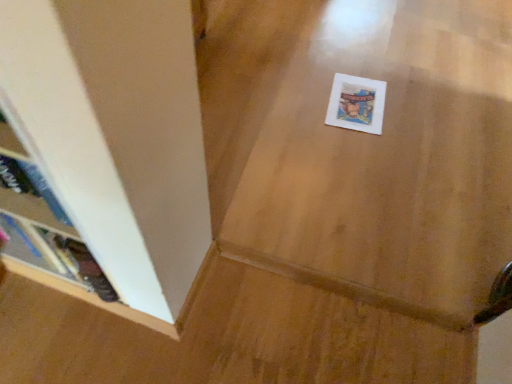
The image size is (512, 384). What do you see at coordinates (42, 220) in the screenshot?
I see `wooden bookshelf at left` at bounding box center [42, 220].

Identify the location of wooden bookshelf at left. The width and height of the screenshot is (512, 384). (42, 220).

Where is `white paper postcard at center`? The width and height of the screenshot is (512, 384). white paper postcard at center is located at coordinates (356, 104).

Measure the distance between white paper postcard at center and camera.

white paper postcard at center and camera are 5.18 feet apart from each other.

The width and height of the screenshot is (512, 384). What do you see at coordinates (356, 104) in the screenshot?
I see `white paper postcard at center` at bounding box center [356, 104].

Identify the location of wooden bookshelf at left. This screenshot has width=512, height=384. (42, 220).

Between wooden bookshelf at left and white paper postcard at center, which one appears on the right side from the viewer's perspective?

Positioned to the right is white paper postcard at center.

Is wooden bookshelf at left closer to camera compared to white paper postcard at center?

Yes, wooden bookshelf at left is in front of white paper postcard at center.

Is point (108, 282) positioned after point (382, 123)?

No, (108, 282) is closer to viewer.

Consider the image. From the image's perspective, which is above, wooden bookshelf at left or white paper postcard at center?

white paper postcard at center, from the image's perspective.

From a real-world perspective, is wooden bookshelf at left located higher than white paper postcard at center?

Yes, from a real-world perspective, wooden bookshelf at left is on top of white paper postcard at center.

In terms of width, does wooden bookshelf at left look wider or thinner when compared to white paper postcard at center?

wooden bookshelf at left is thinner than white paper postcard at center.

Which of these two, wooden bookshelf at left or white paper postcard at center, stands shorter?

With less height is white paper postcard at center.

Who is bigger, wooden bookshelf at left or white paper postcard at center?

wooden bookshelf at left.

Based on the photo, is wooden bookshelf at left surrounding white paper postcard at center?

Definitely not — white paper postcard at center is not inside wooden bookshelf at left.

Is wooden bookshelf at left beside white paper postcard at center?

There is a gap between wooden bookshelf at left and white paper postcard at center.

Is white paper postcard at center at the back of wooden bookshelf at left?

Yes.

How different are the orientations of wooden bookshelf at left and white paper postcard at center in degrees?

The angle between the facing direction of wooden bookshelf at left and the facing direction of white paper postcard at center is 9.67 degrees.

At what (x,y) coordinates should I click in order to perform the action: click on postcard that is behind the wooden bookshelf at left. Please return your answer as a coordinate pair (x, y). The height and width of the screenshot is (384, 512). Looking at the image, I should click on (356, 104).

Does white paper postcard at center appear on the left side of wooden bookshelf at left?

In fact, white paper postcard at center is to the right of wooden bookshelf at left.

Which object is more forward, white paper postcard at center or wooden bookshelf at left?

wooden bookshelf at left.

Which is more distant, (335, 106) or (62, 229)?

Point (335, 106)

From the image's perspective, between white paper postcard at center and wooden bookshelf at left, who is located below?

wooden bookshelf at left, from the image's perspective.

From a real-world perspective, is white paper postcard at center physically located above or below wooden bookshelf at left?

white paper postcard at center is situated lower than wooden bookshelf at left in the real world.

Considering the relative sizes of white paper postcard at center and wooden bookshelf at left in the image provided, is white paper postcard at center thinner than wooden bookshelf at left?

No.

Looking at this image, considering the sizes of white paper postcard at center and wooden bookshelf at left in the image, is white paper postcard at center taller or shorter than wooden bookshelf at left?

Clearly, white paper postcard at center is shorter compared to wooden bookshelf at left.

Does white paper postcard at center have a larger size compared to wooden bookshelf at left?

Actually, white paper postcard at center might be smaller than wooden bookshelf at left.

Is wooden bookshelf at left surrounded by white paper postcard at center?

Definitely not — wooden bookshelf at left is not inside white paper postcard at center.

Is white paper postcard at center positioned far away from wooden bookshelf at left?

Yes.

Does white paper postcard at center turn towards wooden bookshelf at left?

No, white paper postcard at center is not aimed at wooden bookshelf at left.

What's the angular difference between white paper postcard at center and wooden bookshelf at left's facing directions?

The angle between the facing direction of white paper postcard at center and the facing direction of wooden bookshelf at left is 9.67 degrees.

The width and height of the screenshot is (512, 384). I want to click on postcard lying behind the wooden bookshelf at left, so click(356, 104).

Image resolution: width=512 pixels, height=384 pixels. Identify the location of postcard on the right of wooden bookshelf at left. (356, 104).

Locate an element on the screen. postcard that appears behind the wooden bookshelf at left is located at coordinates (356, 104).